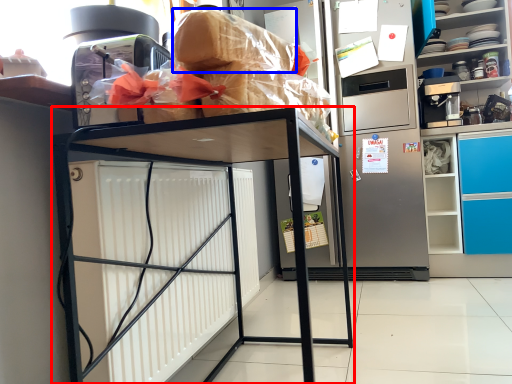
Question: Which of the following is the farthest to the observer, furniture (highlighted by a red box) or bread (highlighted by a blue box)?

Choices:
 (A) furniture
 (B) bread

Answer: (B)